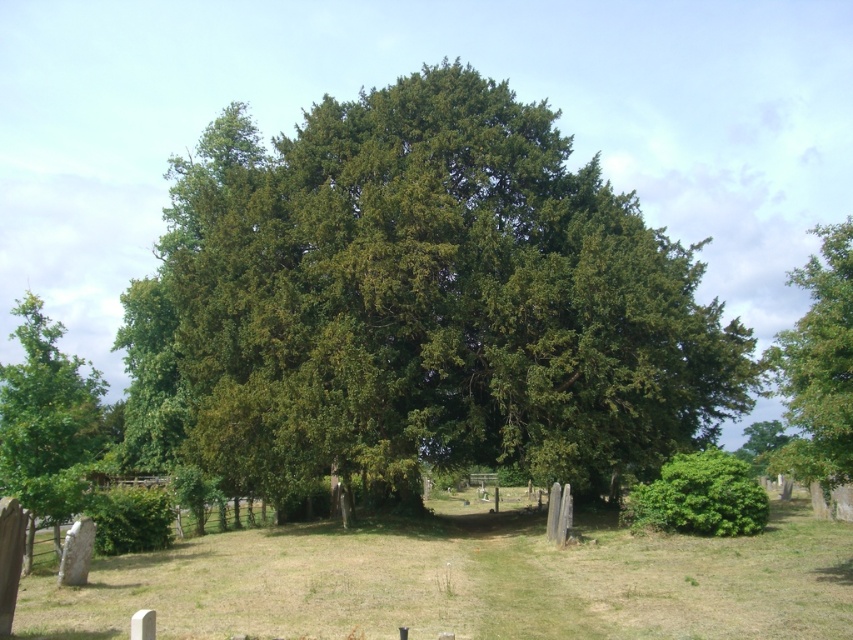
Question: Estimate the real-world distances between objects in this image. Which object is farther from the green leafy tree at right?

Choices:
 (A) green leafy tree at left
 (B) green leafy tree at center

Answer: (A)

Question: Which object is positioned farthest from the green leafy tree at right?

Choices:
 (A) green grassy field at center
 (B) green leafy tree at center
 (C) green leafy tree at left

Answer: (C)

Question: Estimate the real-world distances between objects in this image. Which object is closer to the green leafy tree at right?

Choices:
 (A) green leafy tree at left
 (B) green leafy tree at center

Answer: (B)

Question: Is the position of green leafy tree at left more distant than that of green leafy tree at right?

Choices:
 (A) yes
 (B) no

Answer: (A)

Question: Does green grassy field at center have a lesser width compared to green leafy tree at right?

Choices:
 (A) yes
 (B) no

Answer: (A)

Question: Can you confirm if green leafy tree at center is positioned to the left of green grassy field at center?

Choices:
 (A) yes
 (B) no

Answer: (B)